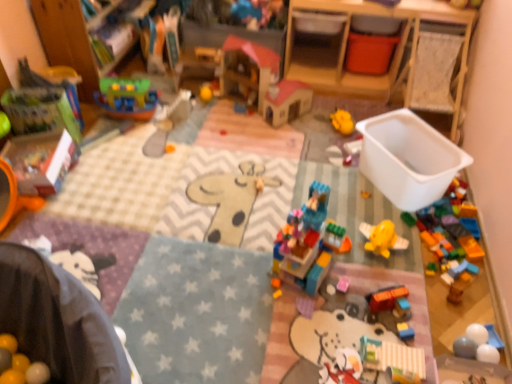
Question: Would you say translucent plastic airplane at center, which appears as the seventh toy when viewed from the top, is part of wooden dollhouse at center, which is counted as the 9th toy, starting from the bottom,'s contents?

Choices:
 (A) no
 (B) yes

Answer: (A)

Question: Is the depth of wooden dollhouse at center, which is counted as the 9th toy, starting from the bottom, greater than that of translucent plastic airplane at center, placed as the fourth toy when sorted from bottom to top?

Choices:
 (A) no
 (B) yes

Answer: (B)

Question: Could you tell me if wooden dollhouse at center, marked as the 2th toy in a top-to-bottom arrangement, is facing translucent plastic airplane at center, placed as the fourth toy when sorted from bottom to top?

Choices:
 (A) no
 (B) yes

Answer: (A)

Question: Is wooden dollhouse at center, which is counted as the 9th toy, starting from the bottom, outside translucent plastic airplane at center, which appears as the seventh toy when viewed from the top?

Choices:
 (A) yes
 (B) no

Answer: (A)

Question: Does wooden dollhouse at center, which is counted as the 9th toy, starting from the bottom, have a greater height compared to translucent plastic airplane at center, placed as the fourth toy when sorted from bottom to top?

Choices:
 (A) no
 (B) yes

Answer: (B)

Question: Is wooden changing table at upper right to the left or to the right of yellow matte ball at center, which is the 8th toy from bottom to top, in the image?

Choices:
 (A) right
 (B) left

Answer: (A)

Question: Is wooden changing table at upper right bigger or smaller than yellow matte ball at center, acting as the 3th toy starting from the top?

Choices:
 (A) small
 (B) big

Answer: (B)

Question: Considering the positions of wooden changing table at upper right and yellow matte ball at center, acting as the 3th toy starting from the top, in the image, is wooden changing table at upper right taller or shorter than yellow matte ball at center, acting as the 3th toy starting from the top,?

Choices:
 (A) short
 (B) tall

Answer: (B)

Question: Is point (449, 77) closer or farther from the camera than point (204, 89)?

Choices:
 (A) farther
 (B) closer

Answer: (B)

Question: Is translucent plastic castle at center, marked as the third toy in a bottom-to-top arrangement, situated inside wooden changing table at upper right or outside?

Choices:
 (A) inside
 (B) outside

Answer: (B)

Question: Is translucent plastic castle at center, the 8th toy from the top, wider or thinner than wooden changing table at upper right?

Choices:
 (A) thin
 (B) wide

Answer: (A)

Question: Does point (322, 187) appear closer or farther from the camera than point (424, 6)?

Choices:
 (A) closer
 (B) farther

Answer: (A)

Question: From a real-world perspective, is translucent plastic castle at center, marked as the third toy in a bottom-to-top arrangement, physically located above or below wooden changing table at upper right?

Choices:
 (A) below
 (B) above

Answer: (A)

Question: Which is correct: wooden dollhouse at center, which is counted as the 9th toy, starting from the bottom, is inside orange matte car at center, arranged as the ninth toy when viewed from the top, or outside of it?

Choices:
 (A) inside
 (B) outside

Answer: (B)

Question: Relative to orange matte car at center, the 2th toy from the bottom, is wooden dollhouse at center, which is counted as the 9th toy, starting from the bottom, in front or behind?

Choices:
 (A) behind
 (B) front

Answer: (A)